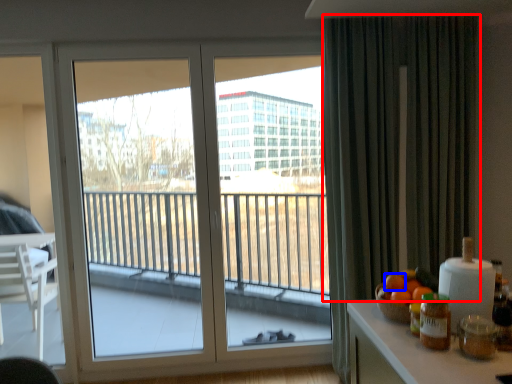
Question: Which of the following is the closest to the observer, curtain (highlighted by a red box) or orange (highlighted by a blue box)?

Choices:
 (A) curtain
 (B) orange

Answer: (B)